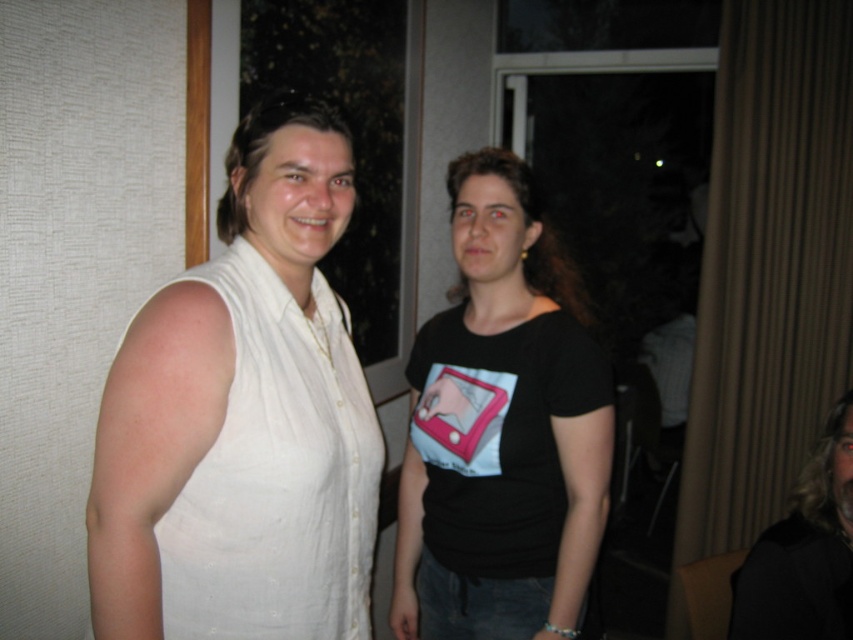
You are a photographer setting up a shot of the scene. You want to ensure that the white linen dress at left and the black matte hair at upper right are both in focus. Given their widths, which object should you adjust your camera settings to prioritize focusing on first?

The white linen dress at left has a lesser width compared to black matte hair at upper right. Since the dress is narrower, you should prioritize focusing on the black matte hair at upper right first to ensure it remains sharp in the photo.